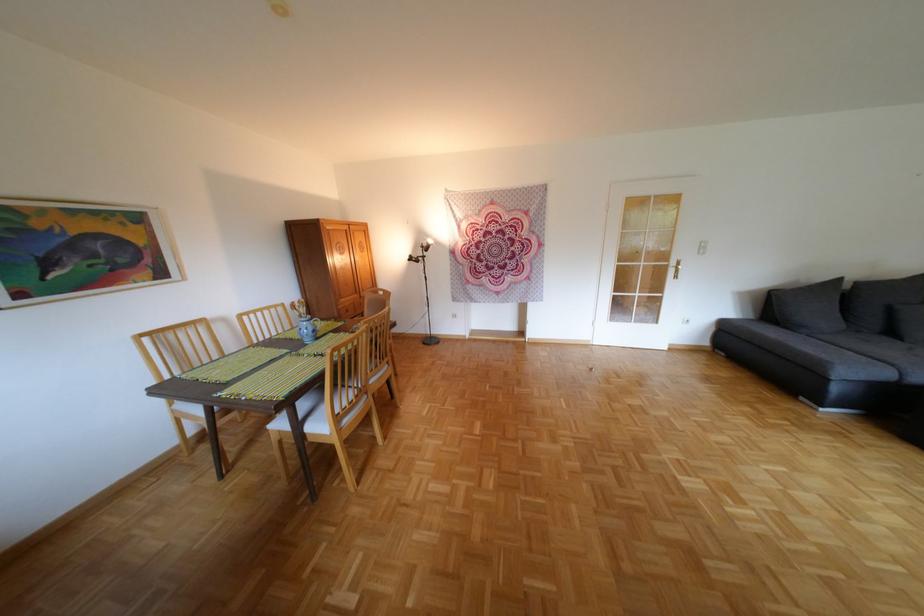
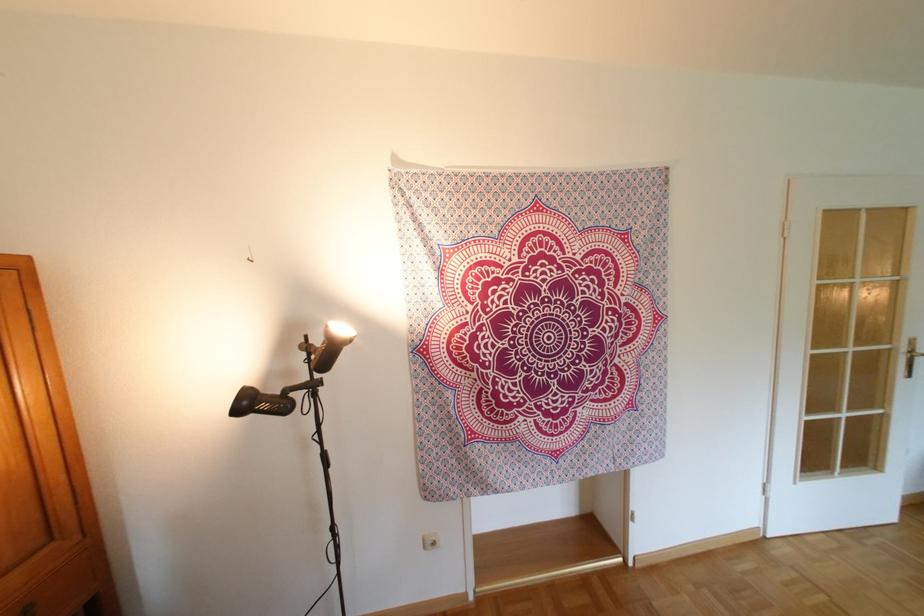
Question: What movement of the cameraman would produce the second image?

Choices:
 (A) Left
 (B) Right
 (C) Forward
 (D) Backward

Answer: (C)